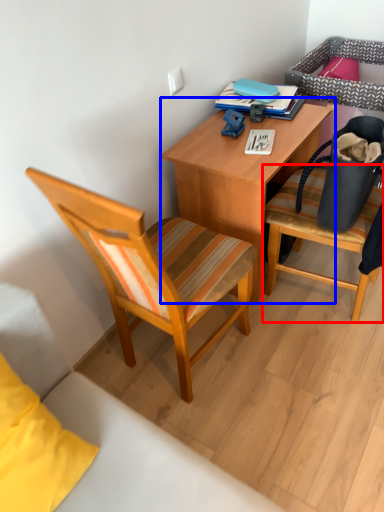
Question: Which object is closer to the camera taking this photo, chair (highlighted by a red box) or desk (highlighted by a blue box)?

Choices:
 (A) chair
 (B) desk

Answer: (A)